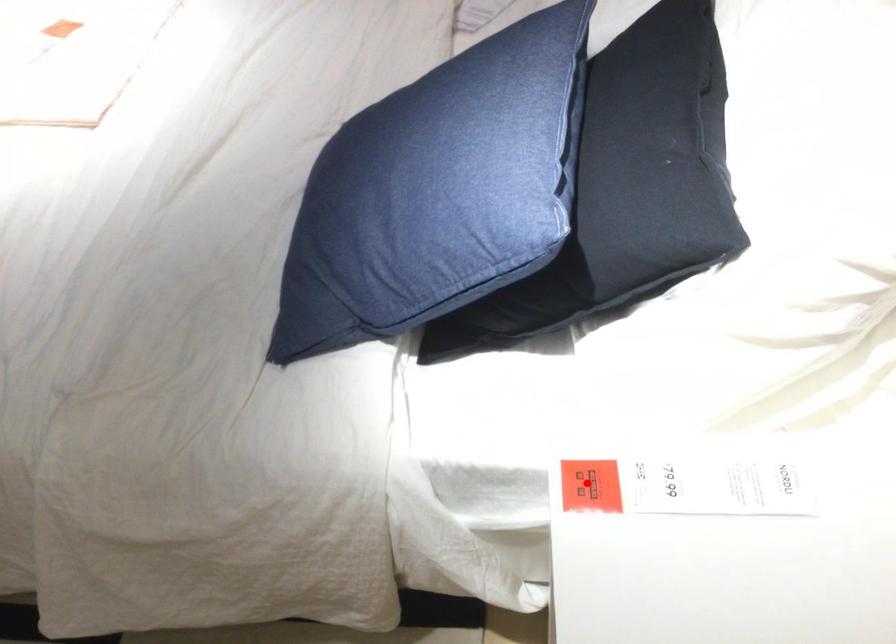
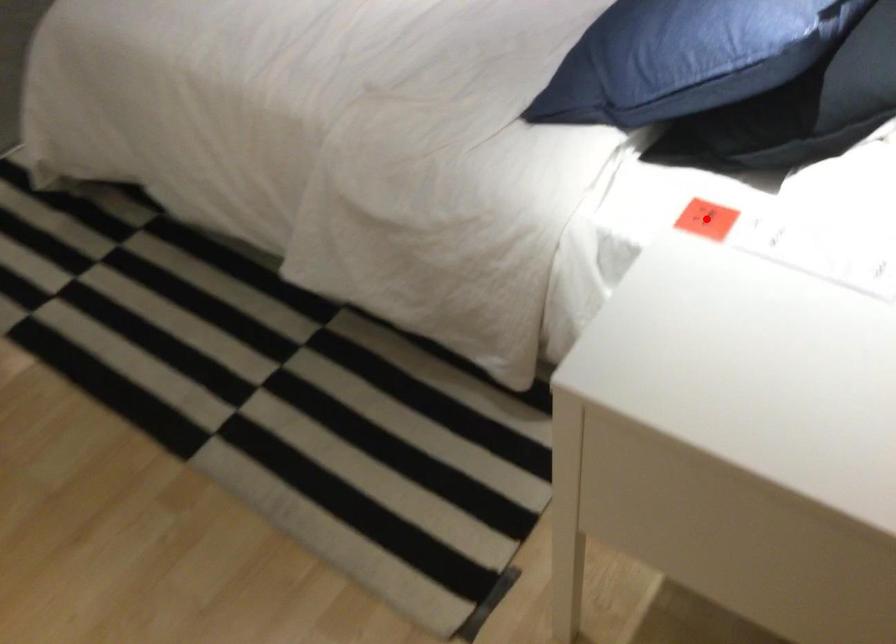
I am providing you with two images of the same scene from different viewpoints. A red point is marked on the first image and another point is marked on the second image. Are the points marked in image1 and image2 representing the same 3D position?

Yes